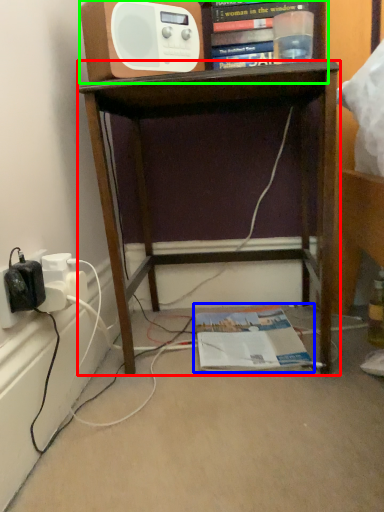
Question: Considering the real-world distances, which object is closest to desk (highlighted by a red box)? magazine (highlighted by a blue box) or shelf (highlighted by a green box).

Choices:
 (A) magazine
 (B) shelf

Answer: (B)